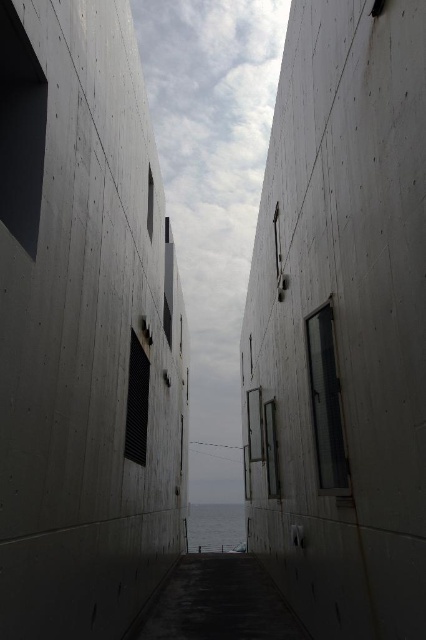
Who is taller, concrete textured wall at center or blue water at center?

With more height is blue water at center.

The image size is (426, 640). What are the coordinates of `concrete textured wall at center` in the screenshot? It's located at (85, 330).

Who is more distant from viewer, (x=140, y=636) or (x=209, y=513)?

Point (x=209, y=513)

Which of these two, dark gray concrete at center or blue water at center, stands taller?

blue water at center is taller.

This screenshot has height=640, width=426. What are the coordinates of `dark gray concrete at center` in the screenshot? It's located at (219, 602).

Locate an element on the screen. dark gray concrete at center is located at coordinates (219, 602).

Is concrete textured wall at center below dark gray concrete at center?

Actually, concrete textured wall at center is above dark gray concrete at center.

Is point (88, 586) positioned after point (268, 592)?

No, it is in front of (268, 592).

In order to click on concrete textured wall at center in this screenshot , I will do `click(85, 330)`.